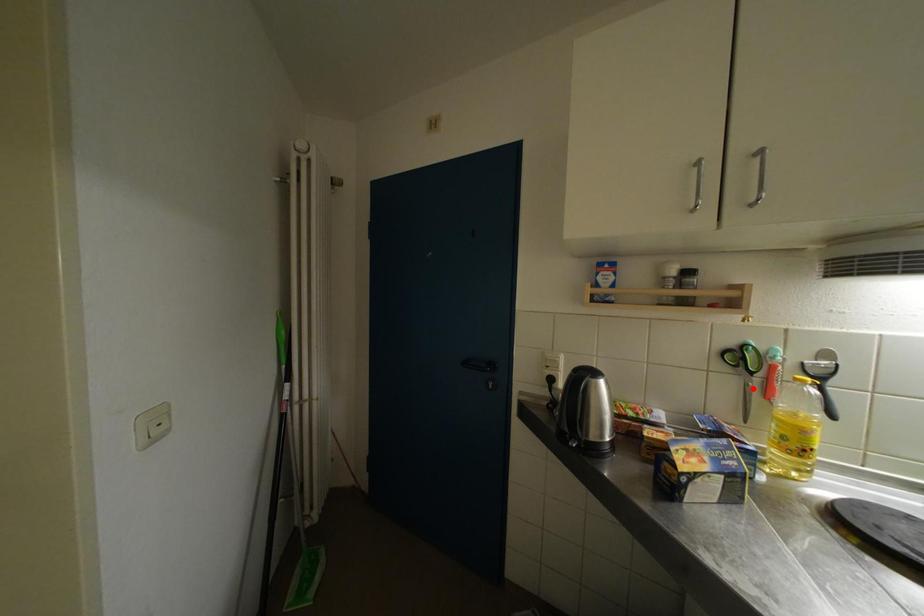
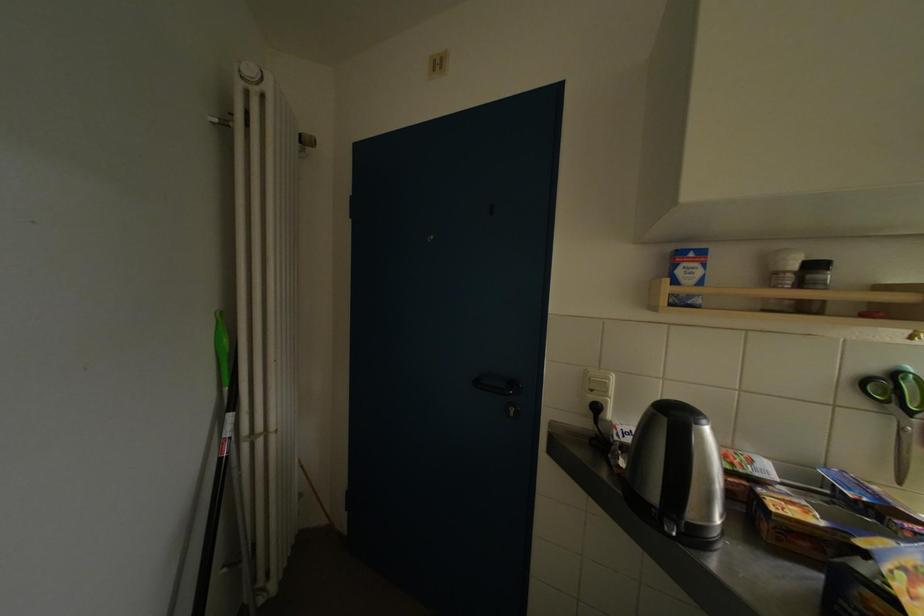
Question: I am providing you with two images of the same scene from different viewpoints. Image1 has a red point marked. In image2, the corresponding 3D location appears at what relative position? Reply with the corresponding letter.

Choices:
 (A) Closer
 (B) Farther

Answer: (A)